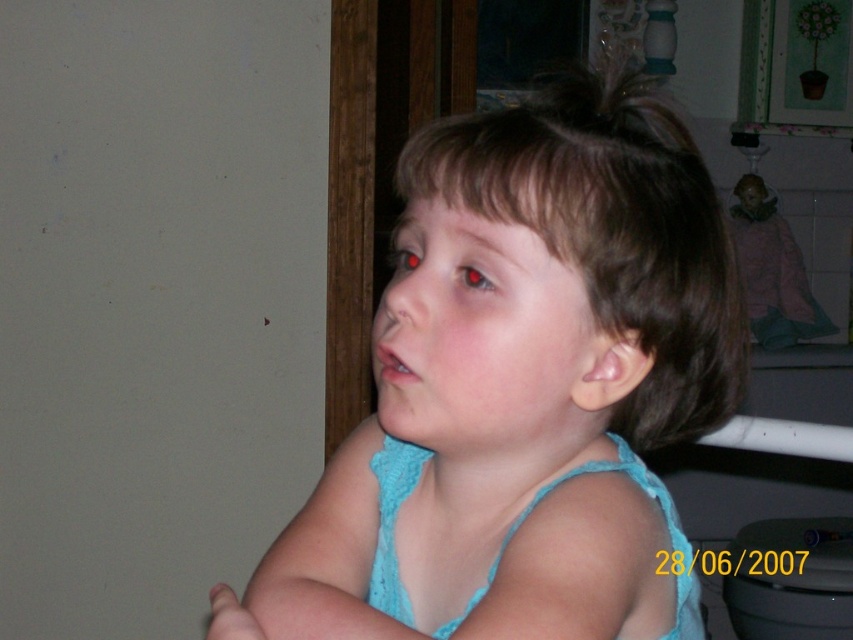
Based on the photo, you are a photographer trying to capture a clear shot of the light blue fabric at center and the brown smooth hair at center. Which object should you focus on first if you want to ensure both are in focus, given their heights?

The light blue fabric at center is much taller than the brown smooth hair at center, so you should focus on the light blue fabric at center first to ensure both are in focus.

You are a photographer setting up for a portrait. The subject is the child in the scene. You need to ensure that the light blue fabric at center and the brown smooth hair at center are both visible in the frame. Given their widths, which object should you prioritize keeping in the frame if space is limited?

The light blue fabric at center is wider than the brown smooth hair at center, so you should prioritize keeping the light blue fabric at center in the frame to ensure it is fully visible.